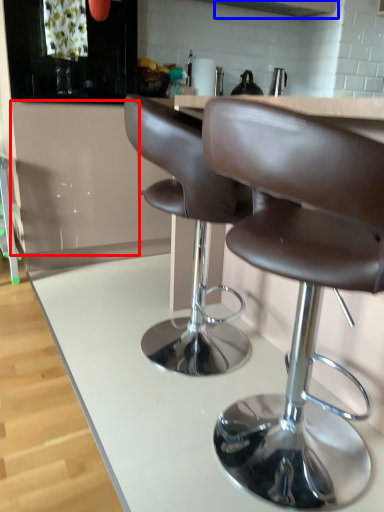
Question: Which object appears closest to the camera in this image, cabinetry (highlighted by a red box) or exhaust hood (highlighted by a blue box)?

Choices:
 (A) cabinetry
 (B) exhaust hood

Answer: (A)